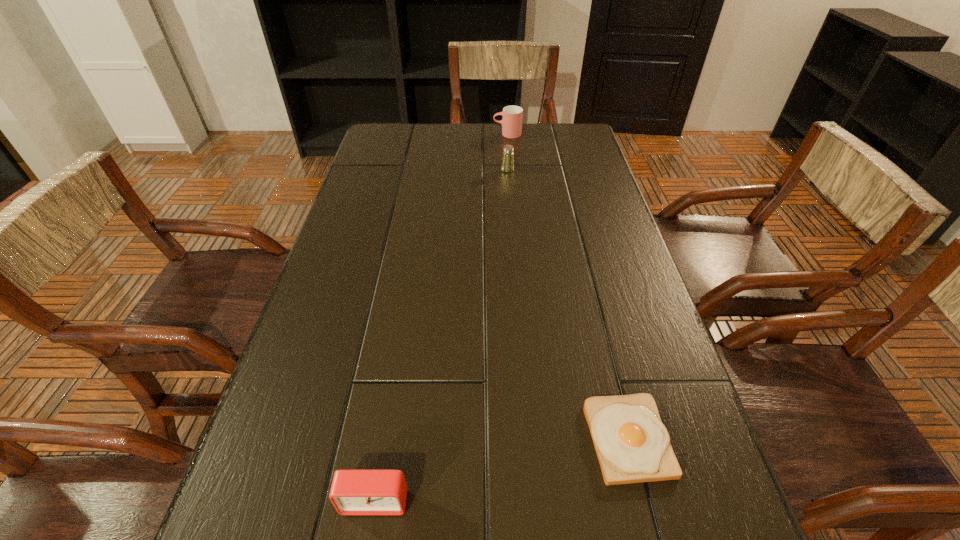
At what (x,y) coordinates should I click in order to perform the action: click on the farthest object. Please return your answer as a coordinate pair (x, y). Looking at the image, I should click on (511, 122).

Where is `saltshaker`? saltshaker is located at coordinates (507, 165).

You are a GUI agent. You are given a task and a screenshot of the screen. Output one action in this format:
    pyautogui.click(x=<x>, y=<y>)
    Task: Click on the leftmost object
    
    Given the screenshot: What is the action you would take?
    pyautogui.click(x=353, y=492)

In order to click on the shortest object in this screenshot , I will do `click(632, 444)`.

The height and width of the screenshot is (540, 960). Find the location of `toast`. toast is located at coordinates (632, 444).

The height and width of the screenshot is (540, 960). In order to click on vacant space located 0.340m on the side of the cup with the handle in this screenshot , I will do `click(396, 134)`.

The height and width of the screenshot is (540, 960). Identify the location of free region located 0.150m on the side of the cup with the handle. (450, 134).

Identify the location of free space located 0.250m on the side of the cup with the handle. The image size is (960, 540). (421, 134).

Identify the location of free space located 0.310m on the back of the third nearest object. (503, 123).

Where is `vacant area situated 0.310m on the left of the rightmost object`? vacant area situated 0.310m on the left of the rightmost object is located at coordinates (405, 438).